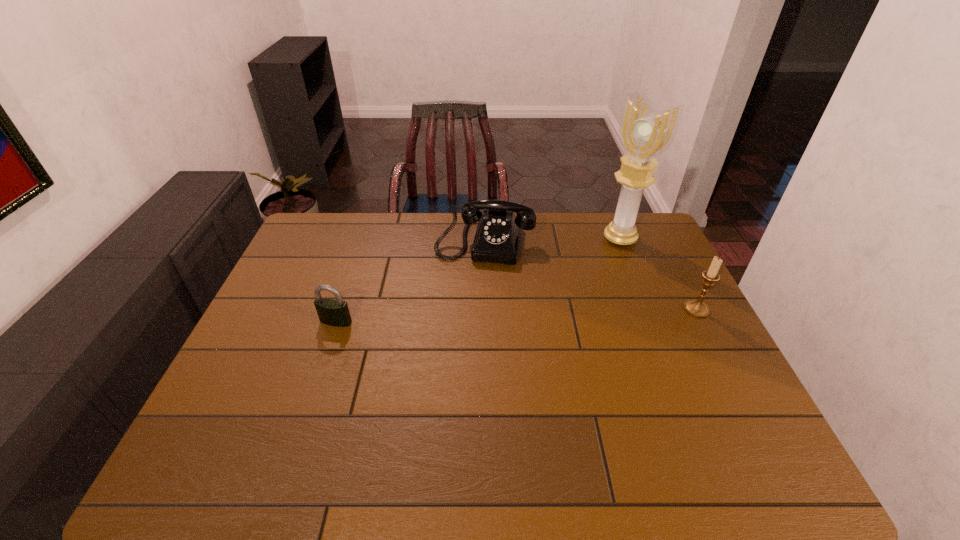
Identify the location of vacant space on the desktop that is between the shortest object and the candle holder and is positioned on the front-facing side of the award. (509, 316).

This screenshot has width=960, height=540. What are the coordinates of `free space on the desktop that is between the leftmost object and the candle holder and is positioned on the dial of the second object from left to right` in the screenshot? It's located at (468, 317).